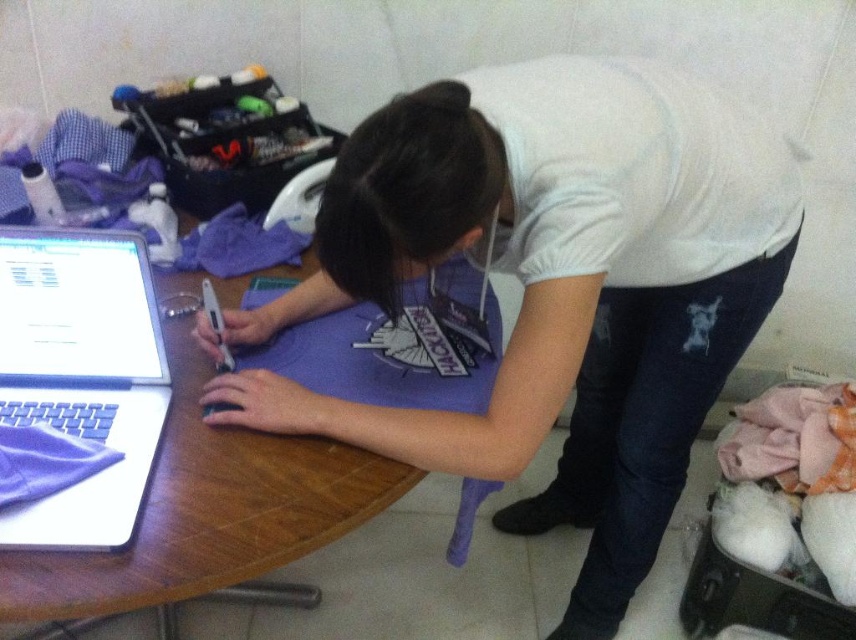
Which is in front, point (467, 224) or point (321, 477)?

Point (467, 224) is in front.

Which of these two, purple matte shirt at center or wooden table at center, stands taller?

purple matte shirt at center is taller.

Between point (660, 138) and point (342, 531), which one is positioned in front?

Point (342, 531) is more forward.

Find the location of `purple matte shirt at center`. purple matte shirt at center is located at coordinates (553, 288).

Does purple matte shirt at center have a larger size compared to white matte laptop at left?

A: Yes.

Is purple matte shirt at center positioned before white matte laptop at left?

No, purple matte shirt at center is behind white matte laptop at left.

Is point (586, 220) positioned before point (100, 292)?

Yes, it is.

I want to click on purple matte shirt at center, so click(x=553, y=288).

Who is higher up, wooden table at center or white matte laptop at left?

wooden table at center is higher up.

Who is taller, wooden table at center or white matte laptop at left?

wooden table at center

Is point (278, 451) positioned in front of point (90, 368)?

That is True.

Locate an element on the screen. The height and width of the screenshot is (640, 856). wooden table at center is located at coordinates (207, 518).